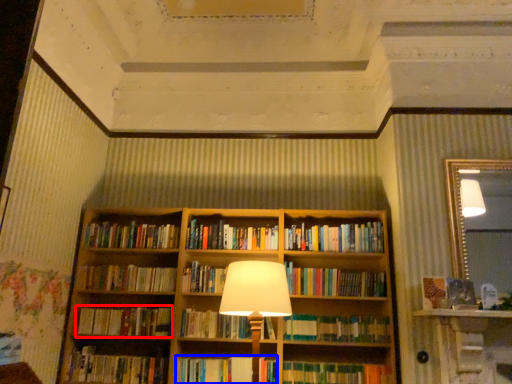
Question: Which object appears closest to the camera in this image, book (highlighted by a red box) or book (highlighted by a blue box)?

Choices:
 (A) book
 (B) book

Answer: (B)